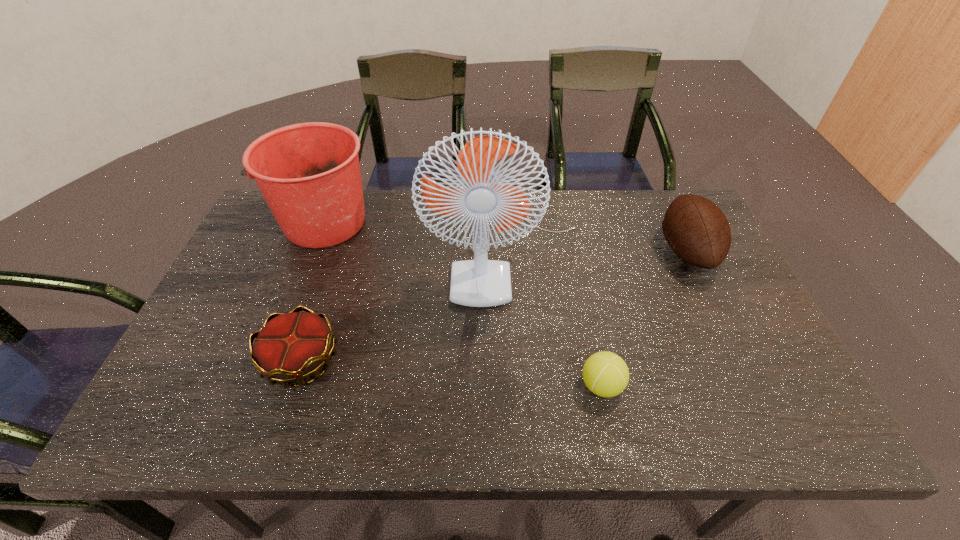
At what (x,y) coordinates should I click in order to perform the action: click on object situated at the far right corner. Please return your answer as a coordinate pair (x, y). The image size is (960, 540). Looking at the image, I should click on (698, 232).

You are a GUI agent. You are given a task and a screenshot of the screen. Output one action in this format:
    pyautogui.click(x=<x>, y=<y>)
    Task: Click on the vacant area at the far edge of the desktop
    Image resolution: width=960 pixels, height=540 pixels.
    Given the screenshot: What is the action you would take?
    pyautogui.click(x=405, y=232)

Locate an element on the screen. The width and height of the screenshot is (960, 540). vacant space at the near edge is located at coordinates (640, 404).

Find the location of a particular element. free space at the right edge of the desktop is located at coordinates [700, 311].

The height and width of the screenshot is (540, 960). Find the location of `vacant space at the far left corner`. vacant space at the far left corner is located at coordinates (260, 218).

The height and width of the screenshot is (540, 960). Find the location of `vacant space at the near left corner of the desktop`. vacant space at the near left corner of the desktop is located at coordinates (147, 434).

Image resolution: width=960 pixels, height=540 pixels. I want to click on free space at the far right corner of the desktop, so pyautogui.click(x=649, y=217).

This screenshot has width=960, height=540. In the image, there is a desktop. Find the location of `vacant space at the near right corner`. vacant space at the near right corner is located at coordinates (792, 427).

Where is `free space between the tallest object and the tennis ball`? This screenshot has height=540, width=960. free space between the tallest object and the tennis ball is located at coordinates click(554, 320).

Locate an element on the screen. unoccupied area between the fan and the tennis ball is located at coordinates (554, 320).